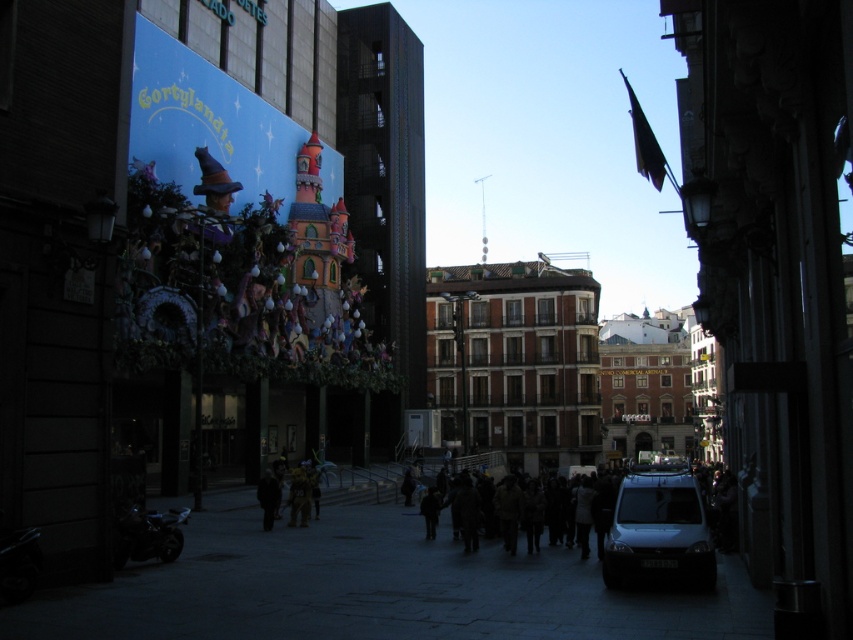
Identify the location of dark brown fabric crowd at center. The image size is (853, 640). (519, 513).

Who is more forward, (573,500) or (262,476)?

Point (573,500) is more forward.

Describe the element at coordinates (519, 513) in the screenshot. Image resolution: width=853 pixels, height=640 pixels. I see `dark brown fabric crowd at center` at that location.

Where is `dark brown fabric crowd at center`? The image size is (853, 640). dark brown fabric crowd at center is located at coordinates (519, 513).

From the picture: Can you confirm if black matte van at center is smaller than black matte jacket at center?

No.

Is point (132, 602) behind point (263, 484)?

That is False.

At what (x,y) coordinates should I click in order to perform the action: click on black matte van at center. Please return your answer as a coordinate pair (x, y). Looking at the image, I should click on (376, 588).

Is point (613, 579) in front of point (270, 529)?

Yes.

At what (x,y) coordinates should I click in order to perform the action: click on white matte van at lower right. Please return your answer as a coordinate pair (x, y). Image resolution: width=853 pixels, height=640 pixels. Looking at the image, I should click on (659, 529).